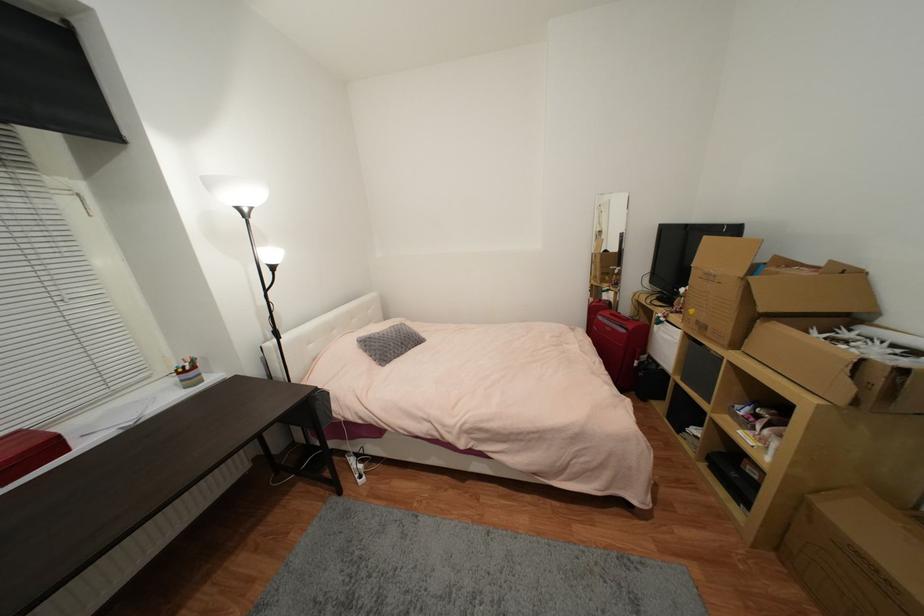
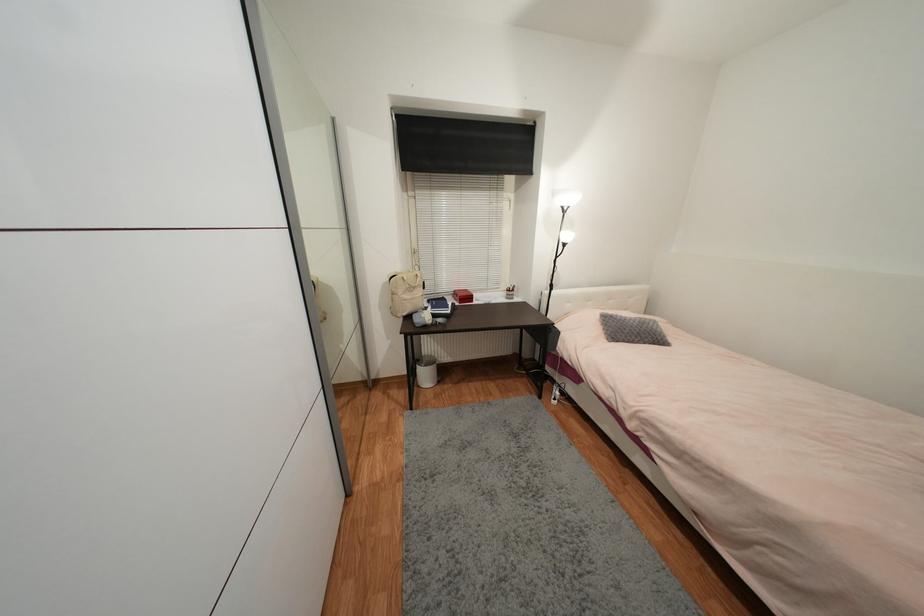
In the second image, find the point that corresponds to point (186, 373) in the first image.

(513, 292)